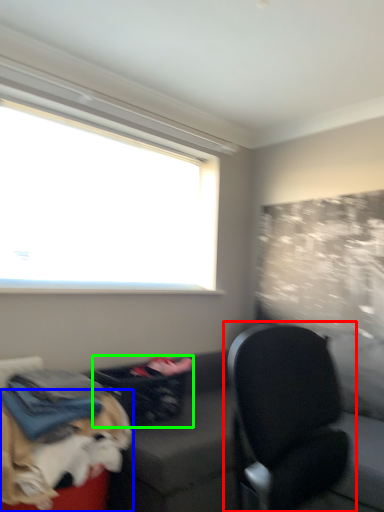
Question: Which object is positioned closest to chair (highlighted by a red box)? Select from dog (highlighted by a blue box) and laundry basket (highlighted by a green box).

Choices:
 (A) dog
 (B) laundry basket

Answer: (A)